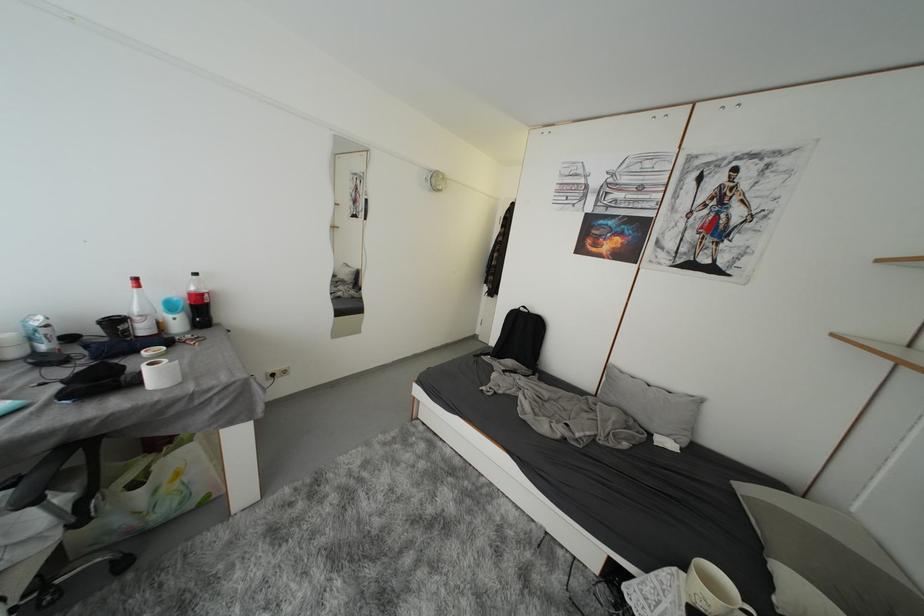
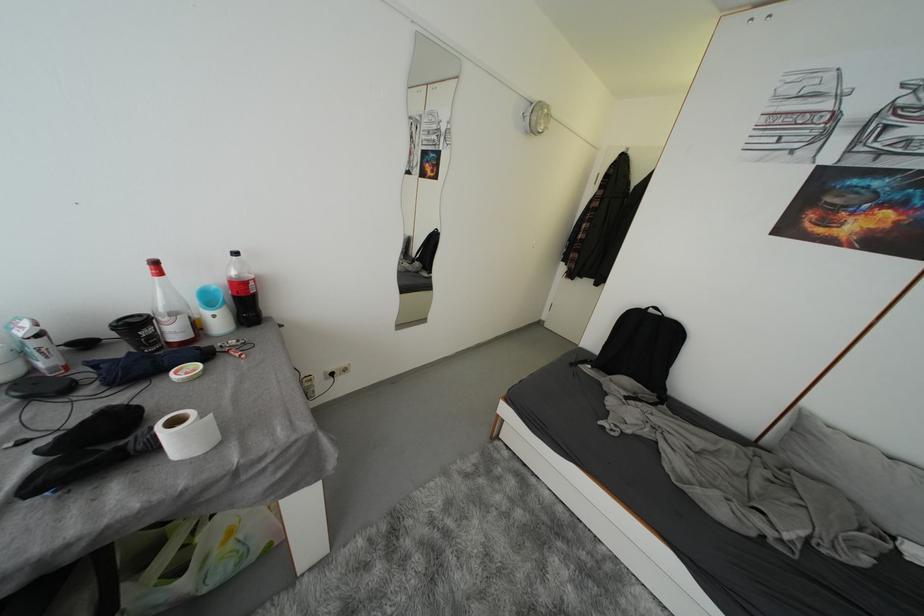
Find the pixel in the second image that matches point (528, 313) in the first image.

(658, 314)